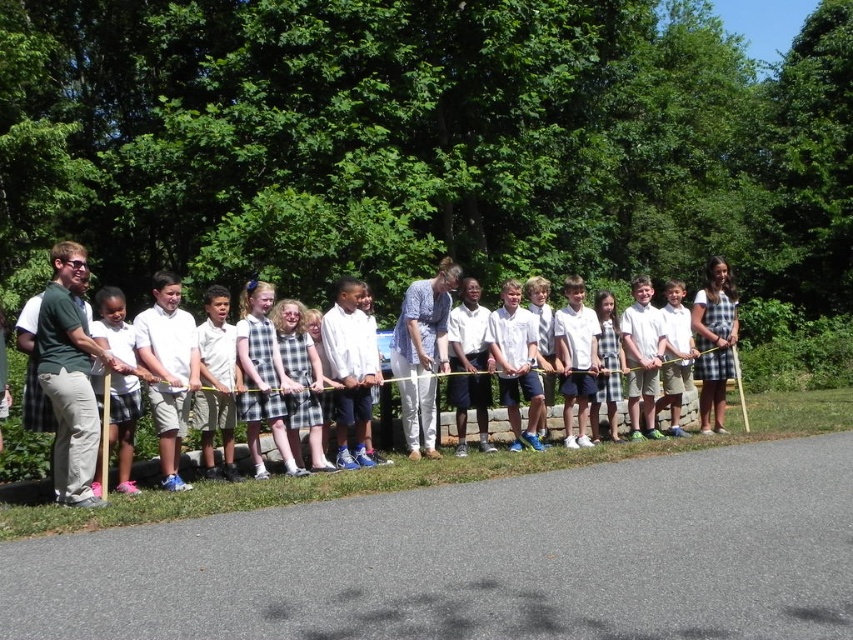
From the picture: Who is positioned more to the right, pink fabric dress at left or plaid skirt at center?

Positioned to the right is plaid skirt at center.

Measure the distance between point (x=129, y=486) and camera.

Point (x=129, y=486) is 28.21 feet away from camera.

Where is `pink fabric dress at left`? pink fabric dress at left is located at coordinates (120, 378).

I want to click on pink fabric dress at left, so click(x=120, y=378).

Can you confirm if pink fabric dress at left is positioned above white cotton dress at center?

Correct, pink fabric dress at left is located above white cotton dress at center.

Looking at this image, who is higher up, pink fabric dress at left or white cotton dress at center?

pink fabric dress at left is above.

Measure the distance between point [119,323] and camera.

The distance of point [119,323] from camera is 8.87 meters.

Find the location of `pink fabric dress at left`. pink fabric dress at left is located at coordinates [120, 378].

Can you confirm if white cotton dress at center is positioned to the right of plaid skirt at center?

No, white cotton dress at center is not to the right of plaid skirt at center.

Is white cotton dress at center to the left of plaid skirt at center from the viewer's perspective?

Correct, you'll find white cotton dress at center to the left of plaid skirt at center.

The image size is (853, 640). Describe the element at coordinates (68, 436) in the screenshot. I see `white cotton dress at center` at that location.

I want to click on white cotton dress at center, so click(x=68, y=436).